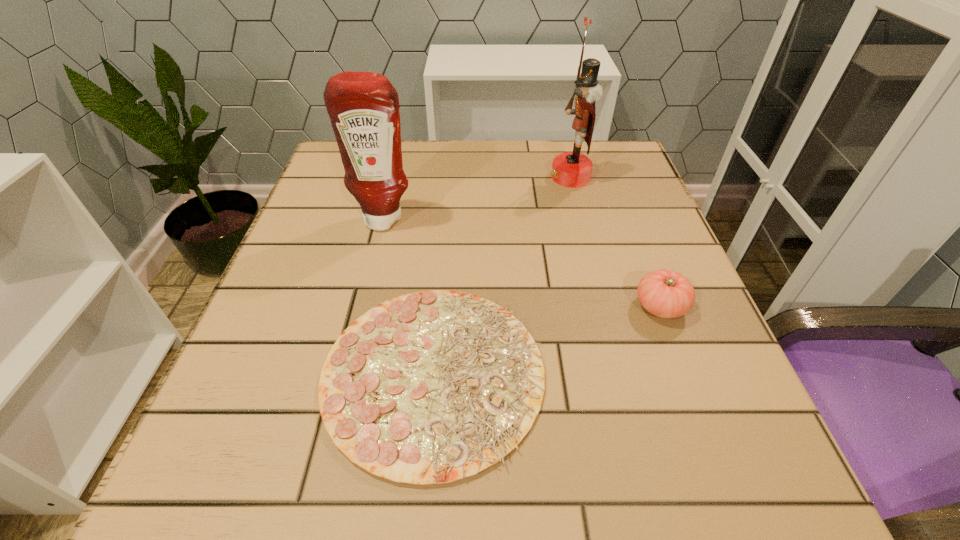
In the image, there is a desktop. Where is `blank space at the far edge`? The width and height of the screenshot is (960, 540). blank space at the far edge is located at coordinates (504, 143).

The image size is (960, 540). In the image, there is a desktop. Find the location of `vacant region at the left edge`. vacant region at the left edge is located at coordinates (199, 434).

Find the location of a particular element. free space at the right edge is located at coordinates (661, 366).

In order to click on blank space at the far left corner in this screenshot , I will do `click(330, 168)`.

The height and width of the screenshot is (540, 960). In order to click on vacant space at the far right corner of the desktop in this screenshot , I will do `click(634, 164)`.

Locate an element on the screen. free space between the condiment and the second object from right to left is located at coordinates (477, 198).

This screenshot has height=540, width=960. Find the location of `vacant point located between the nutcracker and the third nearest object`. vacant point located between the nutcracker and the third nearest object is located at coordinates (477, 198).

Where is `free spot between the rightmost object and the pizza`? The height and width of the screenshot is (540, 960). free spot between the rightmost object and the pizza is located at coordinates (547, 340).

This screenshot has width=960, height=540. I want to click on empty space that is in between the third object from left to right and the rightmost object, so click(615, 241).

The height and width of the screenshot is (540, 960). What are the coordinates of `vacant space that's between the farthest object and the second farthest object` in the screenshot? It's located at click(x=477, y=198).